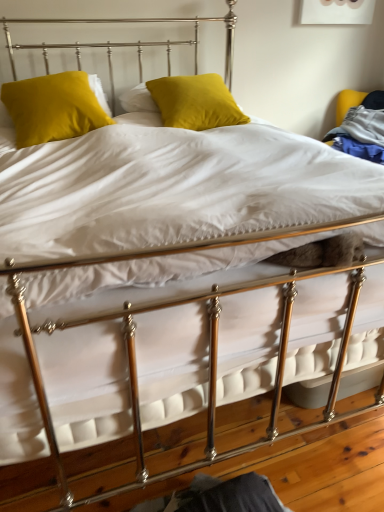
Question: Which direction should I rotate to face satin yellow pillow at center, which is counted as the 1th pillow, starting from the right, — up or down?

Choices:
 (A) up
 (B) down

Answer: (A)

Question: Is velvet yellow pillow at upper left, the 1th pillow from the left, at the right side of satin yellow pillow at center, which ranks as the 2th pillow in left-to-right order?

Choices:
 (A) yes
 (B) no

Answer: (B)

Question: Is velvet yellow pillow at upper left, which is the second pillow from right to left, behind satin yellow pillow at center, which is counted as the 1th pillow, starting from the right?

Choices:
 (A) no
 (B) yes

Answer: (A)

Question: From the image's perspective, would you say velvet yellow pillow at upper left, which is the second pillow from right to left, is shown under satin yellow pillow at center, which ranks as the 2th pillow in left-to-right order?

Choices:
 (A) no
 (B) yes

Answer: (B)

Question: Is velvet yellow pillow at upper left, which is the second pillow from right to left, not near satin yellow pillow at center, which ranks as the 2th pillow in left-to-right order?

Choices:
 (A) yes
 (B) no

Answer: (B)

Question: Does velvet yellow pillow at upper left, the 1th pillow from the left, lie in front of satin yellow pillow at center, which ranks as the 2th pillow in left-to-right order?

Choices:
 (A) yes
 (B) no

Answer: (A)

Question: Considering the relative positions of velvet yellow pillow at upper left, the 1th pillow from the left, and satin yellow pillow at center, which is counted as the 1th pillow, starting from the right, in the image provided, is velvet yellow pillow at upper left, the 1th pillow from the left, to the left of satin yellow pillow at center, which is counted as the 1th pillow, starting from the right, from the viewer's perspective?

Choices:
 (A) no
 (B) yes

Answer: (B)

Question: Considering the relative sizes of satin yellow pillow at center, which is counted as the 1th pillow, starting from the right, and velvet yellow pillow at upper left, the 1th pillow from the left, in the image provided, is satin yellow pillow at center, which is counted as the 1th pillow, starting from the right, wider than velvet yellow pillow at upper left, the 1th pillow from the left,?

Choices:
 (A) yes
 (B) no

Answer: (A)

Question: Is the position of satin yellow pillow at center, which is counted as the 1th pillow, starting from the right, more distant than that of velvet yellow pillow at upper left, the 1th pillow from the left?

Choices:
 (A) yes
 (B) no

Answer: (A)

Question: Is satin yellow pillow at center, which ranks as the 2th pillow in left-to-right order, taller than velvet yellow pillow at upper left, which is the second pillow from right to left?

Choices:
 (A) yes
 (B) no

Answer: (B)

Question: Is satin yellow pillow at center, which ranks as the 2th pillow in left-to-right order, to the right of velvet yellow pillow at upper left, the 1th pillow from the left, from the viewer's perspective?

Choices:
 (A) no
 (B) yes

Answer: (B)

Question: Is velvet yellow pillow at upper left, the 1th pillow from the left, surrounded by satin yellow pillow at center, which is counted as the 1th pillow, starting from the right?

Choices:
 (A) no
 (B) yes

Answer: (A)

Question: Is satin yellow pillow at center, which ranks as the 2th pillow in left-to-right order, shorter than velvet yellow pillow at upper left, which is the second pillow from right to left?

Choices:
 (A) yes
 (B) no

Answer: (A)

Question: Would you say velvet yellow pillow at upper left, the 1th pillow from the left, is inside or outside satin yellow pillow at center, which ranks as the 2th pillow in left-to-right order?

Choices:
 (A) inside
 (B) outside

Answer: (B)